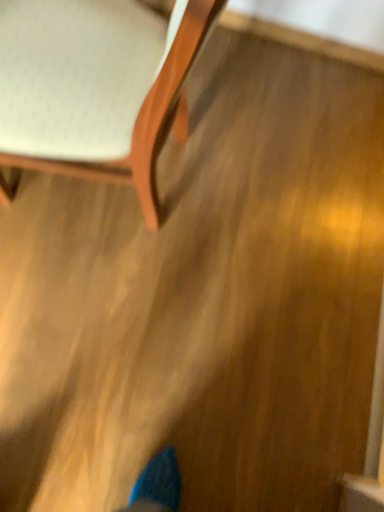
Where is `vacant space to the right of wooden chair at upper left`? This screenshot has width=384, height=512. vacant space to the right of wooden chair at upper left is located at coordinates (229, 236).